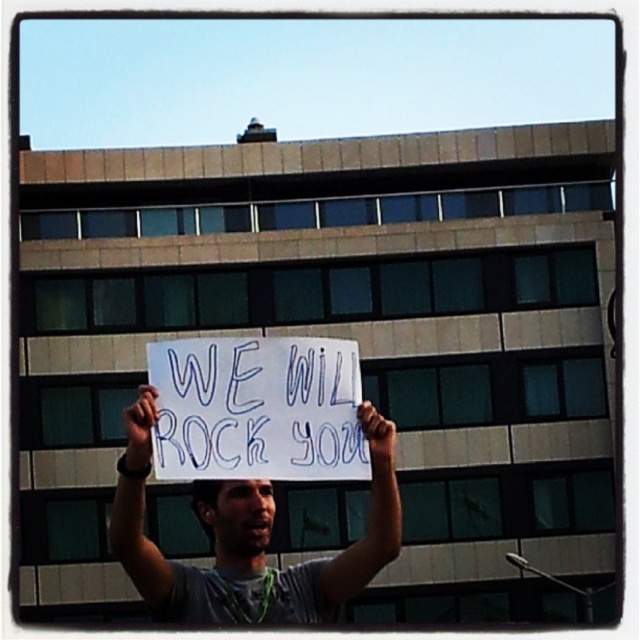
You are a photographer trying to capture the person holding the sign. Which object, the gray fabric shirt at center or the smooth skin hand at center, would appear larger in your photo?

The gray fabric shirt at center would appear larger in the photo because it is closer to the viewer than the smooth skin hand at center.

You are a photographer trying to capture a clear shot of the white paper sign at center and the gray fabric shirt at center. Based on the scene, which object is shorter in height?

The white paper sign at center is not as tall as the gray fabric shirt at center, so the white paper sign at center is shorter in height.